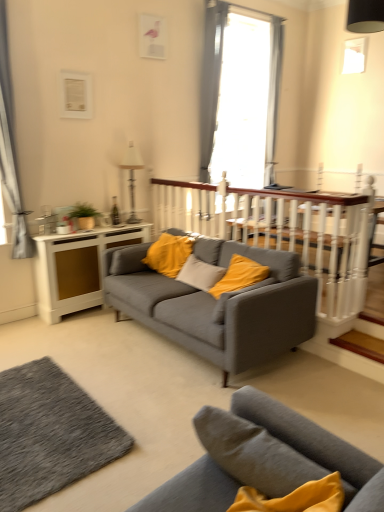
Measure the distance between point (190, 490) and camera.

The distance of point (190, 490) from camera is 4.95 feet.

From the picture: Measure the distance between metallic silver lamp at upper center and camera.

They are 4.47 meters apart.

In order to face white wood side table at left, should I rotate leftwards or rightwards?

To face it directly, rotate left by 12.327 degrees.

What do you see at coordinates (50, 434) in the screenshot? I see `textured gray rug at lower left` at bounding box center [50, 434].

How much space does gray fabric curtain at upper center, which is the 2th curtain from front to back, occupy vertically?

gray fabric curtain at upper center, which is the 2th curtain from front to back, is 6.58 feet tall.

Describe the element at coordinates (218, 304) in the screenshot. I see `matte gray couch at center, which is the first studio couch from back to front` at that location.

Measure the distance between point (14,234) and camera.

The depth of point (14,234) is 3.97 meters.

The height and width of the screenshot is (512, 384). What are the coordinates of `matte gray couch at center, which is counted as the first studio couch, starting from the front` in the screenshot? It's located at (259, 457).

Is matte gray couch at center, the 2th studio couch positioned from the back, at the back of gray fabric curtain at left, which is the second curtain from right to left?

gray fabric curtain at left, which is the second curtain from right to left, is not turned away from matte gray couch at center, the 2th studio couch positioned from the back.

Is gray fabric curtain at left, the first curtain from the left, with matte gray couch at center, the 2th studio couch positioned from the back?

No, gray fabric curtain at left, the first curtain from the left, is not touching matte gray couch at center, the 2th studio couch positioned from the back.

Does gray fabric curtain at left, the first curtain from the left, have a lesser width compared to matte gray couch at center, the 2th studio couch positioned from the back?

Yes.

Where is `studio couch that is the 2nd one when counting downward from the white wood side table at left (from the image's perspective)`? studio couch that is the 2nd one when counting downward from the white wood side table at left (from the image's perspective) is located at coordinates (259, 457).

Is matte gray couch at center, the 2th studio couch positioned from the back, further to the viewer compared to white wood side table at left?

No, the depth of matte gray couch at center, the 2th studio couch positioned from the back, is less than that of white wood side table at left.

Does matte gray couch at center, which is counted as the first studio couch, starting from the front, appear on the right side of white wood side table at left?

Indeed, matte gray couch at center, which is counted as the first studio couch, starting from the front, is positioned on the right side of white wood side table at left.

From the image's perspective, which is below, matte gray couch at center, the second studio couch in the front-to-back sequence, or gray fabric curtain at upper center, placed as the second curtain when sorted from left to right?

matte gray couch at center, the second studio couch in the front-to-back sequence.

Is matte gray couch at center, which is the first studio couch from back to front, far from gray fabric curtain at upper center, which is the 2th curtain from front to back?

That's right, there is a large distance between matte gray couch at center, which is the first studio couch from back to front, and gray fabric curtain at upper center, which is the 2th curtain from front to back.

Considering the positions of objects matte gray couch at center, the second studio couch in the front-to-back sequence, and gray fabric curtain at upper center, which appears as the 1th curtain when viewed from the right, in the image provided, who is more to the right, matte gray couch at center, the second studio couch in the front-to-back sequence, or gray fabric curtain at upper center, which appears as the 1th curtain when viewed from the right,?

Positioned to the right is gray fabric curtain at upper center, which appears as the 1th curtain when viewed from the right.

Does matte gray couch at center, which is the first studio couch from back to front, turn towards gray fabric curtain at upper center, placed as the second curtain when sorted from left to right?

No, matte gray couch at center, which is the first studio couch from back to front, does not turn towards gray fabric curtain at upper center, placed as the second curtain when sorted from left to right.

From a real-world perspective, does wooden at center sit lower than metallic silver lamp at upper center?

Yes, from a real-world perspective, wooden at center is under metallic silver lamp at upper center.

Is wooden at center next to metallic silver lamp at upper center?

wooden at center and metallic silver lamp at upper center are not in contact.

How distant is wooden at center from metallic silver lamp at upper center?

wooden at center and metallic silver lamp at upper center are 2.65 meters apart.

Can you confirm if wooden at center is bigger than metallic silver lamp at upper center?

No, wooden at center is not bigger than metallic silver lamp at upper center.

From the picture: From a real-world perspective, is white wood side table at left below matte gray couch at center, the second studio couch in the front-to-back sequence?

Correct, in the physical world, white wood side table at left is lower than matte gray couch at center, the second studio couch in the front-to-back sequence.

Could matte gray couch at center, which is the first studio couch from back to front, be considered to be inside white wood side table at left?

No, white wood side table at left does not contain matte gray couch at center, which is the first studio couch from back to front.

Is white wood side table at left in front of matte gray couch at center, which is the first studio couch from back to front?

No, white wood side table at left is behind matte gray couch at center, which is the first studio couch from back to front.

Locate an element on the screen. Image resolution: width=384 pixels, height=512 pixels. the 1st studio couch in front of the white wood side table at left, counting from the anchor's position is located at coordinates (218, 304).

From the image's perspective, which one is positioned lower, white wood side table at left or matte gray couch at center, which is counted as the first studio couch, starting from the front?

From the image's view, matte gray couch at center, which is counted as the first studio couch, starting from the front, is below.

Is white wood side table at left inside the boundaries of matte gray couch at center, which is counted as the first studio couch, starting from the front, or outside?

white wood side table at left is not enclosed by matte gray couch at center, which is counted as the first studio couch, starting from the front.

Does point (98, 283) lie behind point (216, 490)?

Yes.

Is gray fabric curtain at upper center, which appears as the 1th curtain when viewed from the right, in contact with white wooden balustrade at center?

gray fabric curtain at upper center, which appears as the 1th curtain when viewed from the right, and white wooden balustrade at center are clearly separated.

Is gray fabric curtain at upper center, which is the 2th curtain from front to back, positioned with its back to white wooden balustrade at center?

No.

Can you confirm if gray fabric curtain at upper center, placed as the second curtain when sorted from left to right, is shorter than white wooden balustrade at center?

Incorrect, the height of gray fabric curtain at upper center, placed as the second curtain when sorted from left to right, does not fall short of that of white wooden balustrade at center.

From a real-world perspective, relative to white wooden balustrade at center, is gray fabric curtain at upper center, placed as the second curtain when sorted from left to right, vertically above or below?

gray fabric curtain at upper center, placed as the second curtain when sorted from left to right, is above white wooden balustrade at center.

Where is `studio couch that is the 2nd object to the right of the gray fabric curtain at left, the second curtain positioned from the back, starting at the anchor`? The image size is (384, 512). studio couch that is the 2nd object to the right of the gray fabric curtain at left, the second curtain positioned from the back, starting at the anchor is located at coordinates (259, 457).

What are the coordinates of `studio couch that is the 2nd one above the white wood side table at left (from a real-world perspective)` in the screenshot? It's located at (259, 457).

Estimate the real-world distances between objects in this image. Which object is closer to metallic silver lamp at upper center, gray fabric curtain at upper center, which appears as the 1th curtain when viewed from the right, or wooden at center?

gray fabric curtain at upper center, which appears as the 1th curtain when viewed from the right.

Looking at the image, which one is located further to matte gray couch at center, the second studio couch in the front-to-back sequence, white wood side table at left or metallic silver lamp at upper center?

Among the two, metallic silver lamp at upper center is located further to matte gray couch at center, the second studio couch in the front-to-back sequence.

Considering their positions, is gray fabric curtain at upper center, which is the 2th curtain from front to back, positioned closer to gray fabric curtain at left, the first curtain from the left, than matte gray couch at center, which is the first studio couch from back to front?

Based on the image, matte gray couch at center, which is the first studio couch from back to front, appears to be nearer to gray fabric curtain at left, the first curtain from the left.

Looking at the image, which one is located further to white wood side table at left, matte gray couch at center, which is the first studio couch from back to front, or gray fabric curtain at upper center, which is the 2th curtain from front to back?

gray fabric curtain at upper center, which is the 2th curtain from front to back, lies further to white wood side table at left than the other object.

When comparing their distances from textured gray rug at lower left, does white wood side table at left or white wooden balustrade at center seem closer?

white wood side table at left is closer to textured gray rug at lower left.

From the image, which object appears to be nearer to white wood side table at left, matte gray couch at center, which is counted as the first studio couch, starting from the front, or gray fabric curtain at left, the second curtain positioned from the back?

gray fabric curtain at left, the second curtain positioned from the back, is positioned closer to the anchor white wood side table at left.

Based on their spatial positions, is white wooden balustrade at center or gray fabric curtain at upper center, placed as the second curtain when sorted from left to right, further from matte gray couch at center, the second studio couch in the front-to-back sequence?

Among the two, gray fabric curtain at upper center, placed as the second curtain when sorted from left to right, is located further to matte gray couch at center, the second studio couch in the front-to-back sequence.

When comparing their distances from gray fabric curtain at upper center, placed as the second curtain when sorted from left to right, does metallic silver lamp at upper center or matte gray couch at center, which is counted as the first studio couch, starting from the front, seem further?

Among the two, matte gray couch at center, which is counted as the first studio couch, starting from the front, is located further to gray fabric curtain at upper center, placed as the second curtain when sorted from left to right.

Where is `table between matte gray couch at center, the 2th studio couch positioned from the back, and gray fabric curtain at upper center, placed as the second curtain when sorted from left to right, from front to back`? This screenshot has width=384, height=512. table between matte gray couch at center, the 2th studio couch positioned from the back, and gray fabric curtain at upper center, placed as the second curtain when sorted from left to right, from front to back is located at coordinates click(x=77, y=267).

The image size is (384, 512). What are the coordinates of `table located between textured gray rug at lower left and metallic silver lamp at upper center in the depth direction` in the screenshot? It's located at (77, 267).

Where is `curtain located between gray fabric curtain at left, which is the second curtain from right to left, and white wooden balustrade at center in the left-right direction`? The width and height of the screenshot is (384, 512). curtain located between gray fabric curtain at left, which is the second curtain from right to left, and white wooden balustrade at center in the left-right direction is located at coordinates (210, 80).

Image resolution: width=384 pixels, height=512 pixels. I want to click on plain positioned between matte gray couch at center, which is counted as the first studio couch, starting from the front, and matte gray couch at center, the second studio couch in the front-to-back sequence, from near to far, so click(50, 434).